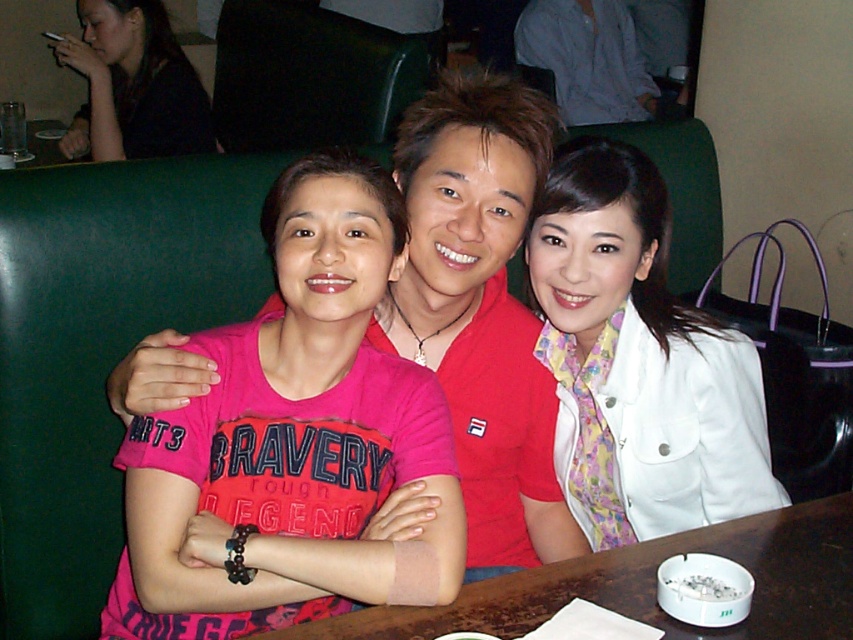
Question: Does brown wooden table at center have a smaller size compared to matte black hair at upper left?

Choices:
 (A) yes
 (B) no

Answer: (A)

Question: Estimate the real-world distances between objects in this image. Which object is farther from the pink matte t-shirt at center?

Choices:
 (A) brown wooden table at center
 (B) matte black hair at upper left
 (C) white satin jacket at upper right

Answer: (B)

Question: Does pink matte t-shirt at center have a lesser width compared to matte black hair at upper left?

Choices:
 (A) no
 (B) yes

Answer: (B)

Question: Estimate the real-world distances between objects in this image. Which object is closer to the pink matte t-shirt at center?

Choices:
 (A) matte black hair at upper left
 (B) white satin jacket at upper right
 (C) brown wooden table at center

Answer: (C)

Question: Can you confirm if pink matte t-shirt at center is smaller than brown wooden table at center?

Choices:
 (A) yes
 (B) no

Answer: (B)

Question: Which object appears closest to the camera in this image?

Choices:
 (A) pink matte t-shirt at center
 (B) matte black hair at upper left
 (C) brown wooden table at center

Answer: (C)